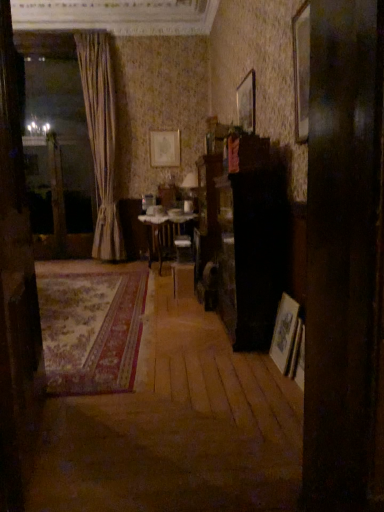
At what (x,y) coordinates should I click in order to perform the action: click on wooden picture frame at upper right, positioned as the 2th picture frame in right-to-left order. Please return your answer as a coordinate pair (x, y). This screenshot has height=512, width=384. Looking at the image, I should click on (247, 103).

Measure the distance between beige fabric curtain at left and camera.

The distance of beige fabric curtain at left from camera is 4.13 meters.

Describe the element at coordinates (101, 139) in the screenshot. This screenshot has height=512, width=384. I see `beige fabric curtain at left` at that location.

You are a GUI agent. You are given a task and a screenshot of the screen. Output one action in this format:
    pyautogui.click(x=<x>, y=<y>)
    Task: Click on the wooden floor at center
    
    Given the screenshot: What is the action you would take?
    click(x=176, y=426)

You are a GUI agent. You are given a task and a screenshot of the screen. Output one action in this format:
    pyautogui.click(x=<x>, y=<y>)
    Task: Click on the wooden door at left
    The image size is (384, 512).
    Given the screenshot: What is the action you would take?
    pyautogui.click(x=15, y=288)

Identify the location of matte gold picture frame at upper center, which is the 1th picture frame in back-to-front order. (165, 148).

The height and width of the screenshot is (512, 384). I want to click on wooden table at center, so click(x=161, y=229).

Does wooden picture frame at upper right, which is counted as the 2th picture frame, starting from the top, have a smaller size compared to wooden floor at center?

Indeed, wooden picture frame at upper right, which is counted as the 2th picture frame, starting from the top, has a smaller size compared to wooden floor at center.

Does point (244, 115) lie in front of point (240, 454)?

No, (244, 115) is behind (240, 454).

Is wooden picture frame at upper right, which is counted as the 2th picture frame, starting from the top, in front of or behind wooden floor at center in the image?

Visually, wooden picture frame at upper right, which is counted as the 2th picture frame, starting from the top, is located behind wooden floor at center.

The image size is (384, 512). I want to click on corridor below the wooden picture frame at upper right, positioned as the second picture frame in front-to-back order (from the image's perspective), so click(176, 426).

From a real-world perspective, is carpeted rug at center above or below wooden table at center?

In terms of real-world spatial position, carpeted rug at center is below wooden table at center.

From the image's perspective, which object appears higher, carpeted rug at center or wooden table at center?

wooden table at center is shown above in the image.

In terms of height, does carpeted rug at center look taller or shorter compared to wooden table at center?

Considering their sizes, carpeted rug at center has less height than wooden table at center.

At what (x,y) coordinates should I click in order to perform the action: click on table that is above the carpeted rug at center (from the image's perspective). Please return your answer as a coordinate pair (x, y). The height and width of the screenshot is (512, 384). Looking at the image, I should click on click(161, 229).

From the image's perspective, is beige fabric curtain at left over matte gold picture frame at upper center, arranged as the 3th picture frame when ordered from the bottom?

No, from the image's perspective, beige fabric curtain at left is not above matte gold picture frame at upper center, arranged as the 3th picture frame when ordered from the bottom.

Consider the image. Is beige fabric curtain at left bigger or smaller than matte gold picture frame at upper center, arranged as the 3th picture frame when ordered from the bottom?

beige fabric curtain at left is bigger than matte gold picture frame at upper center, arranged as the 3th picture frame when ordered from the bottom.

Considering the positions of points (95, 34) and (174, 164), is point (95, 34) closer to camera compared to point (174, 164)?

Yes, it is in front of point (174, 164).

Considering the relative sizes of wooden picture frame at right, arranged as the 1th picture frame when ordered from the bottom, and wooden floor at center in the image provided, is wooden picture frame at right, arranged as the 1th picture frame when ordered from the bottom, taller than wooden floor at center?

Correct, wooden picture frame at right, arranged as the 1th picture frame when ordered from the bottom, is much taller as wooden floor at center.

From a real-world perspective, is wooden picture frame at right, the 3th picture frame viewed from the left, physically below wooden floor at center?

Actually, wooden picture frame at right, the 3th picture frame viewed from the left, is physically above wooden floor at center in the real world.

Does point (293, 335) come behind point (166, 422)?

Yes, point (293, 335) is farther from viewer.

Considering the relative positions of wooden picture frame at right, the first picture frame in the right-to-left sequence, and wooden floor at center in the image provided, is wooden picture frame at right, the first picture frame in the right-to-left sequence, to the left of wooden floor at center from the viewer's perspective?

In fact, wooden picture frame at right, the first picture frame in the right-to-left sequence, is to the right of wooden floor at center.

Between wooden picture frame at right, the first picture frame in the right-to-left sequence, and wooden picture frame at upper right, which is the 2th picture frame from left to right, which one has smaller width?

With smaller width is wooden picture frame at upper right, which is the 2th picture frame from left to right.

From the image's perspective, between wooden picture frame at right, the 3th picture frame in the top-to-bottom sequence, and wooden picture frame at upper right, which is the second picture frame in bottom-to-top order, who is located below?

wooden picture frame at right, the 3th picture frame in the top-to-bottom sequence, appears lower in the image.

How different are the orientations of wooden picture frame at right, which is counted as the third picture frame, starting from the back, and wooden picture frame at upper right, which is the second picture frame in bottom-to-top order, in degrees?

The facing directions of wooden picture frame at right, which is counted as the third picture frame, starting from the back, and wooden picture frame at upper right, which is the second picture frame in bottom-to-top order, are 1.11 degrees apart.

The width and height of the screenshot is (384, 512). Identify the location of corridor located below the beige fabric curtain at left (from the image's perspective). (176, 426).

Considering the sizes of objects wooden floor at center and beige fabric curtain at left in the image provided, who is shorter, wooden floor at center or beige fabric curtain at left?

wooden floor at center is shorter.

Does point (219, 387) appear closer or farther from the camera than point (109, 93)?

Point (219, 387) appears to be closer to the viewer than point (109, 93).

Which of these two, wooden picture frame at right, the 3th picture frame in the top-to-bottom sequence, or carpeted rug at center, stands taller?

Standing taller between the two is wooden picture frame at right, the 3th picture frame in the top-to-bottom sequence.

Is wooden picture frame at right, the 3th picture frame viewed from the left, to the left or to the right of carpeted rug at center in the image?

wooden picture frame at right, the 3th picture frame viewed from the left, is positioned on carpeted rug at center's right side.

Which of these two, wooden picture frame at right, the 1th picture frame in the front-to-back sequence, or carpeted rug at center, is smaller?

With smaller size is wooden picture frame at right, the 1th picture frame in the front-to-back sequence.

At what (x,y) coordinates should I click in order to perform the action: click on plain below the wooden picture frame at right, the first picture frame in the right-to-left sequence (from the image's perspective). Please return your answer as a coordinate pair (x, y). Looking at the image, I should click on (91, 329).

Starting from the wooden floor at center, which picture frame is the 2nd one to the right? Please provide its 2D coordinates.

[(247, 103)]

The width and height of the screenshot is (384, 512). Find the location of `table behind the carpeted rug at center`. table behind the carpeted rug at center is located at coordinates (161, 229).

In the scene shown: From the image, which object appears to be farther from wooden table at center, matte gold picture frame at upper center, arranged as the third picture frame when viewed from the right, or wooden floor at center?

wooden floor at center lies further to wooden table at center than the other object.

Estimate the real-world distances between objects in this image. Which object is closer to wooden picture frame at right, which is counted as the third picture frame, starting from the back, carpeted rug at center or wooden door at left?

Based on the image, wooden door at left appears to be nearer to wooden picture frame at right, which is counted as the third picture frame, starting from the back.

From the image, which object appears to be nearer to wooden floor at center, carpeted rug at center or wooden picture frame at upper right, positioned as the second picture frame in front-to-back order?

Based on the image, carpeted rug at center appears to be nearer to wooden floor at center.

Based on the photo, when comparing their distances from wooden floor at center, does matte gold picture frame at upper center, arranged as the 3th picture frame when ordered from the bottom, or wooden door at left seem closer?

Based on the image, wooden door at left appears to be nearer to wooden floor at center.

From the image, which object appears to be nearer to wooden table at center, wooden picture frame at right, arranged as the 1th picture frame when ordered from the bottom, or beige fabric curtain at left?

beige fabric curtain at left.

Looking at the image, which one is located closer to wooden table at center, carpeted rug at center or wooden picture frame at upper right, positioned as the second picture frame in front-to-back order?

Among the two, carpeted rug at center is located nearer to wooden table at center.

Which object lies further to the anchor point matte gold picture frame at upper center, arranged as the third picture frame when viewed from the right, carpeted rug at center or wooden table at center?

carpeted rug at center.

Looking at the image, which one is located closer to wooden picture frame at right, arranged as the 1th picture frame when ordered from the bottom, carpeted rug at center or matte gold picture frame at upper center, which is the third picture frame from front to back?

Based on the image, carpeted rug at center appears to be nearer to wooden picture frame at right, arranged as the 1th picture frame when ordered from the bottom.

The height and width of the screenshot is (512, 384). I want to click on table between wooden picture frame at right, arranged as the 1th picture frame when ordered from the bottom, and beige fabric curtain at left from front to back, so click(161, 229).

I want to click on door situated between carpeted rug at center and wooden picture frame at right, which is counted as the third picture frame, starting from the back, from left to right, so click(15, 288).

Identify the location of table between wooden picture frame at upper right, positioned as the 2th picture frame in right-to-left order, and beige fabric curtain at left, along the z-axis. Image resolution: width=384 pixels, height=512 pixels. (161, 229).

Identify the location of plain located between wooden door at left and wooden picture frame at upper right, positioned as the second picture frame in front-to-back order, in the depth direction. (91, 329).